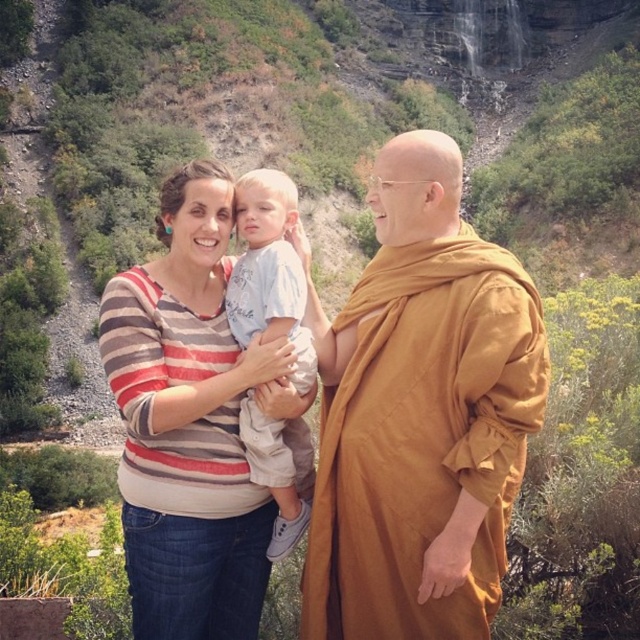
In the serene outdoor scene with a woman holding a child, a brown clothed monk at right, and a light blue cotton shirt at center, which person is bigger?

The brown clothed monk at right is larger in size compared to the light blue cotton shirt at center.

You are a photographer trying to capture a group photo of two people wearing shirts at the center of the scene. The striped fabric shirt at center and the light blue cotton shirt at center. Based on their sizes, which shirt would you focus on to ensure both individuals are visible in the frame?

The striped fabric shirt at center has a larger size compared to the light blue cotton shirt at center, so focusing on the striped fabric shirt at center would ensure both individuals are visible in the frame since it is larger and might be positioned to accommodate both.

In the serene outdoor mountain scene, there are a brown clothed monk at right and a light blue cotton shirt at center. Which of these two individuals is taller?

The brown clothed monk at right is much taller than the light blue cotton shirt at center.